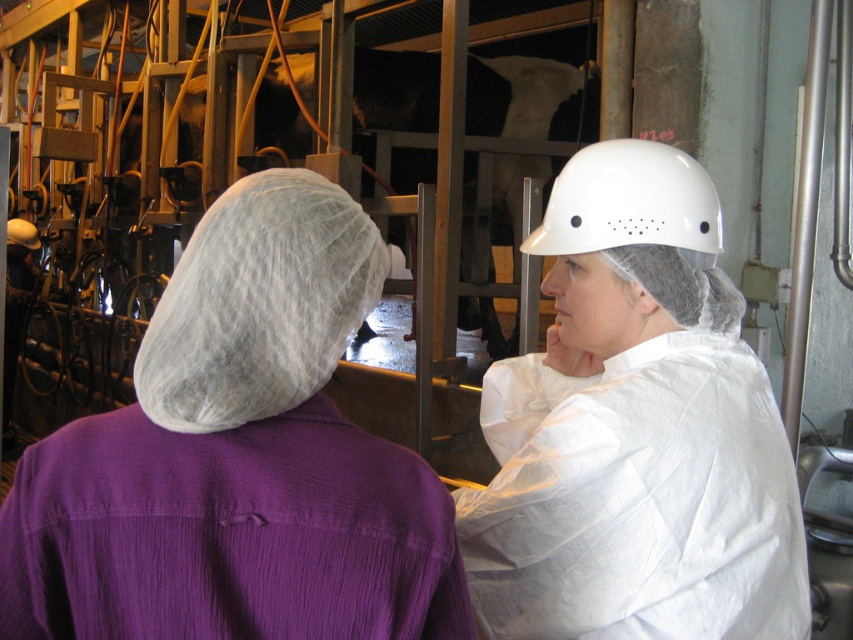
Image resolution: width=853 pixels, height=640 pixels. What do you see at coordinates (238, 460) in the screenshot?
I see `purple fabric shirt at upper left` at bounding box center [238, 460].

Can you confirm if purple fabric shirt at upper left is smaller than white matte helmet at upper center?

No.

What do you see at coordinates (238, 460) in the screenshot? This screenshot has height=640, width=853. I see `purple fabric shirt at upper left` at bounding box center [238, 460].

Where is `purple fabric shirt at upper left`? This screenshot has height=640, width=853. purple fabric shirt at upper left is located at coordinates (238, 460).

Between white matte hard hat at upper right and white hard hat at center, which one appears on the right side from the viewer's perspective?

From the viewer's perspective, white hard hat at center appears more on the right side.

Consider the image. Between white matte hard hat at upper right and white hard hat at center, which one is positioned lower?

white matte hard hat at upper right is lower down.

The image size is (853, 640). I want to click on white matte hard hat at upper right, so click(635, 429).

Can you confirm if white matte helmet at upper center is positioned to the left of white hard hat at center?

Correct, you'll find white matte helmet at upper center to the left of white hard hat at center.

Who is lower down, white matte helmet at upper center or white hard hat at center?

white matte helmet at upper center

Which is behind, point (335, 186) or point (641, 216)?

Point (641, 216)

Locate an element on the screen. The height and width of the screenshot is (640, 853). white matte helmet at upper center is located at coordinates (259, 304).